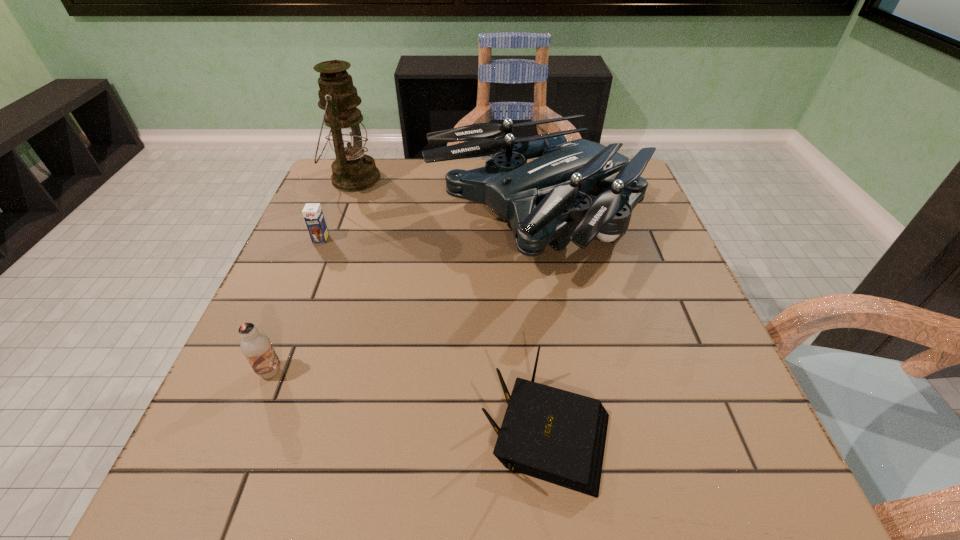
Where is `empty location between the router and the tallest object`? empty location between the router and the tallest object is located at coordinates (450, 304).

Identify which object is the fourth closest to the oil lamp. Please provide its 2D coordinates. Your answer should be formatted as a tuple, i.e. [(x, y)], where the tuple contains the x and y coordinates of a point satisfying the conditions above.

[(557, 436)]

Where is `the second closest object to the tallest object`? the second closest object to the tallest object is located at coordinates (312, 212).

Identify the location of vacant space that satisfies the following two spatial constraints: 1. on the front label of the router; 2. on the left side of the shorter chocolate milk. (243, 429).

I want to click on vacant space that satisfies the following two spatial constraints: 1. on the front label of the router; 2. on the right side of the farther chocolate milk, so click(x=243, y=429).

Find the location of a particular element. This screenshot has height=540, width=960. vacant area that satisfies the following two spatial constraints: 1. on the front side of the oil lamp; 2. on the right side of the fourth shortest object is located at coordinates (336, 224).

At what (x,y) coordinates should I click in order to perform the action: click on vacant region that satisfies the following two spatial constraints: 1. on the front side of the nearer chocolate milk; 2. on the left side of the router. Please return your answer as a coordinate pair (x, y). Looking at the image, I should click on (247, 429).

You are a GUI agent. You are given a task and a screenshot of the screen. Output one action in this format:
    pyautogui.click(x=<x>, y=<y>)
    Task: Click on the free space in the image that satisfies the following two spatial constraints: 1. on the front label of the farther chocolate milk; 2. on the right side of the router
    The image size is (960, 540).
    Given the screenshot: What is the action you would take?
    pyautogui.click(x=243, y=429)